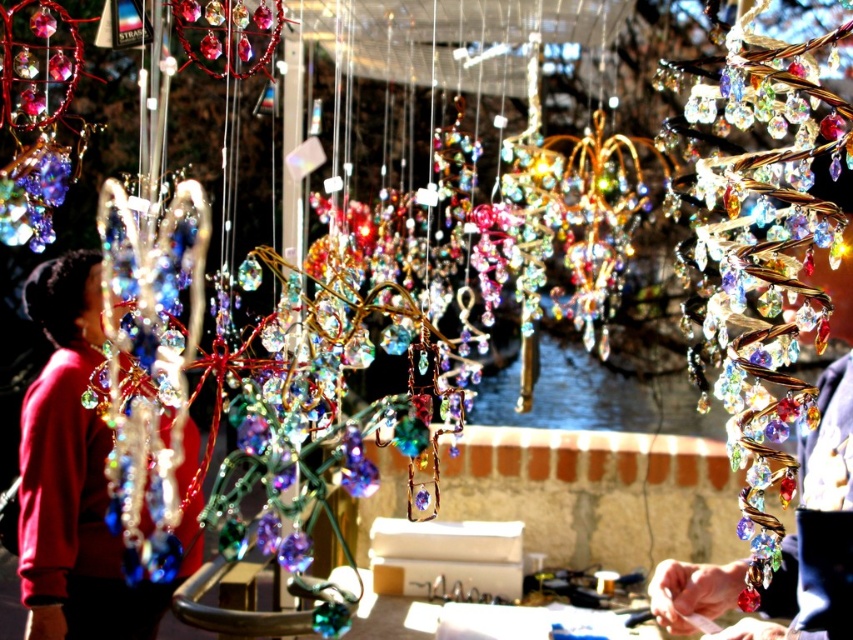
Which is more to the left, multicolored glass ornaments at center or matte red sweater at left?

From the viewer's perspective, matte red sweater at left appears more on the left side.

Which is in front, point (756, 252) or point (74, 282)?

Point (756, 252) is more forward.

Does point (740, 401) come in front of point (53, 424)?

That is True.

The height and width of the screenshot is (640, 853). I want to click on multicolored glass ornaments at center, so click(769, 253).